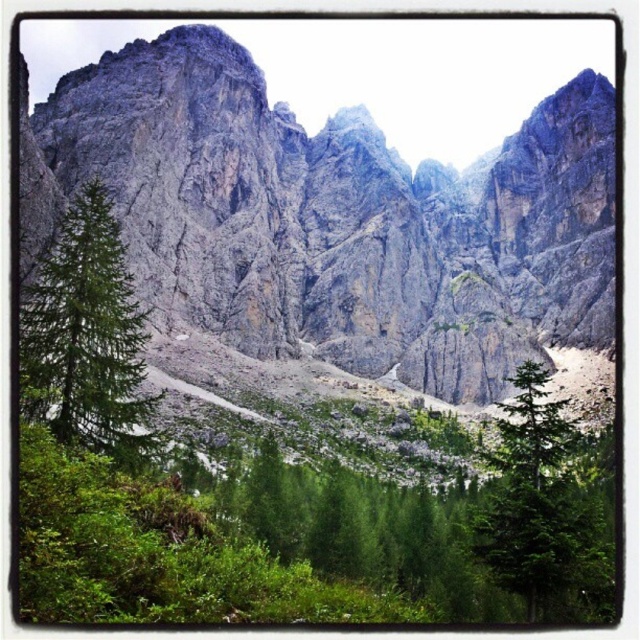
Question: Can you confirm if green matte tree at lower left is positioned above green matte tree at lower right?

Choices:
 (A) no
 (B) yes

Answer: (B)

Question: Among these points, which one is farthest from the camera?

Choices:
 (A) (54, 330)
 (B) (516, 406)

Answer: (B)

Question: Where is green matte tree at lower left located in relation to green matte tree at lower right in the image?

Choices:
 (A) right
 (B) left

Answer: (B)

Question: Is green matte tree at lower left wider than green matte tree at lower right?

Choices:
 (A) yes
 (B) no

Answer: (A)